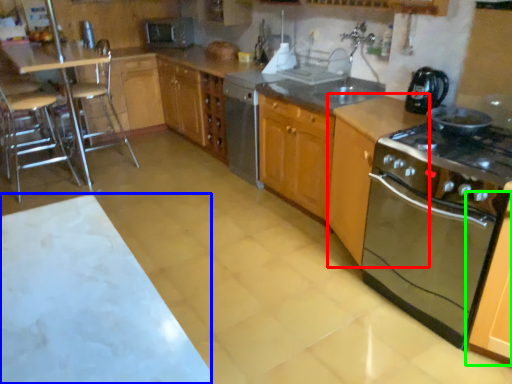
Question: Which is nearer to the cabinetry (highlighted by a red box)? table (highlighted by a blue box) or cabinetry (highlighted by a green box).

Choices:
 (A) table
 (B) cabinetry

Answer: (B)